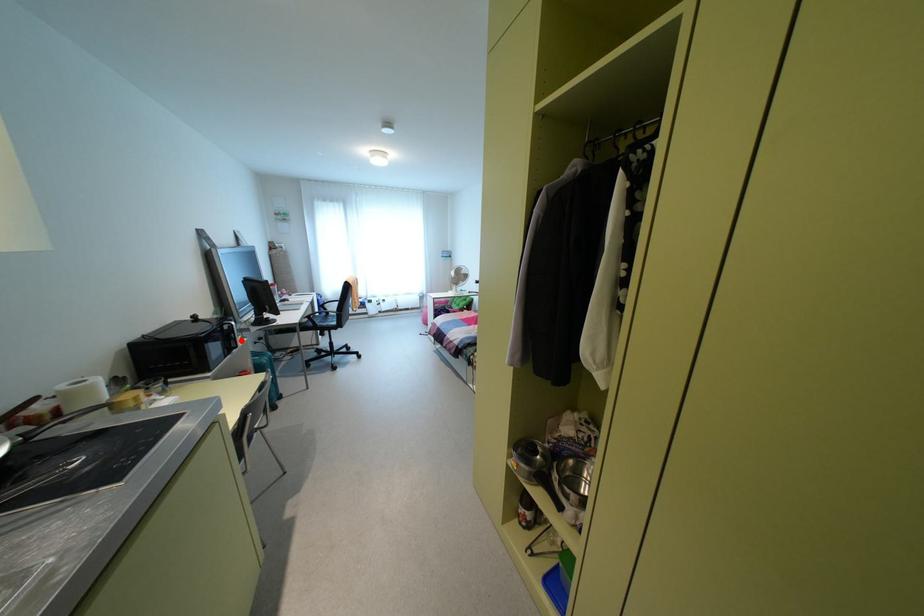
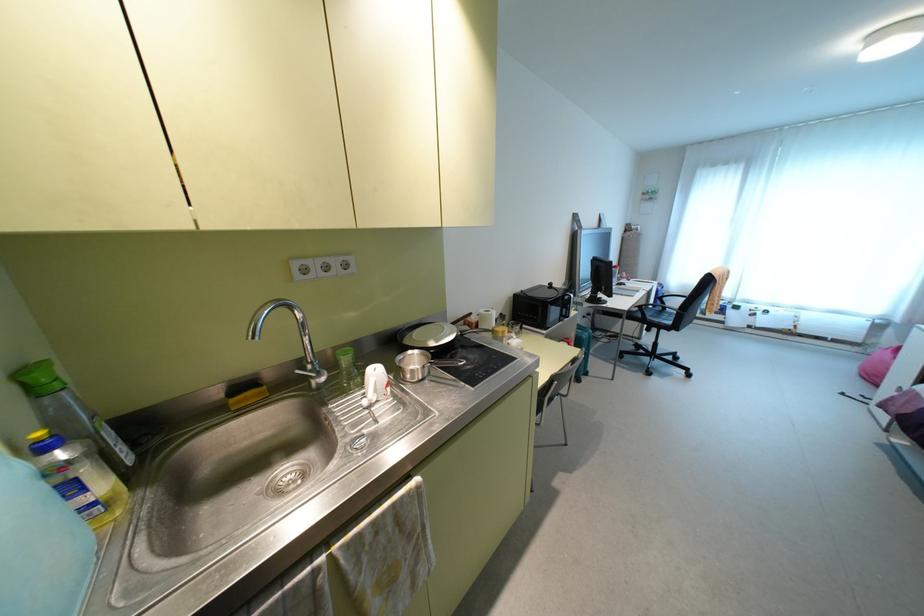
Question: A red point is marked in image1. In image2, is the corresponding 3D point closer to the camera or farther? Reply with the corresponding letter.

Choices:
 (A) The corresponding 3D point is closer.
 (B) The corresponding 3D point is farther.

Answer: (B)